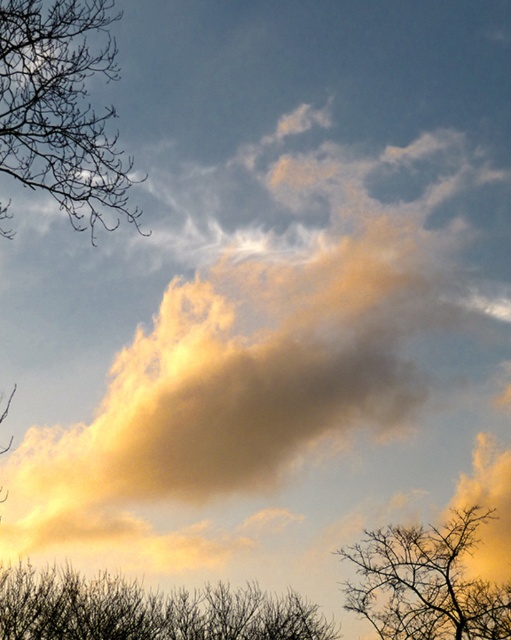
Question: Which is farther from the brown textured tree at lower right?

Choices:
 (A) silhouette bare branches at bottom
 (B) bare branches at left

Answer: (B)

Question: Can you confirm if bare branches at left is wider than silhouette bare branches at bottom?

Choices:
 (A) yes
 (B) no

Answer: (B)

Question: Can you confirm if bare branches at left is thinner than brown textured tree at lower right?

Choices:
 (A) yes
 (B) no

Answer: (A)

Question: Which point is closer to the camera taking this photo?

Choices:
 (A) (103, 192)
 (B) (128, 627)

Answer: (A)

Question: Can you confirm if bare branches at left is positioned to the right of brown textured tree at lower right?

Choices:
 (A) no
 (B) yes

Answer: (A)

Question: Among these points, which one is nearest to the camera?

Choices:
 (A) (58, 614)
 (B) (464, 579)
 (C) (11, 595)

Answer: (A)